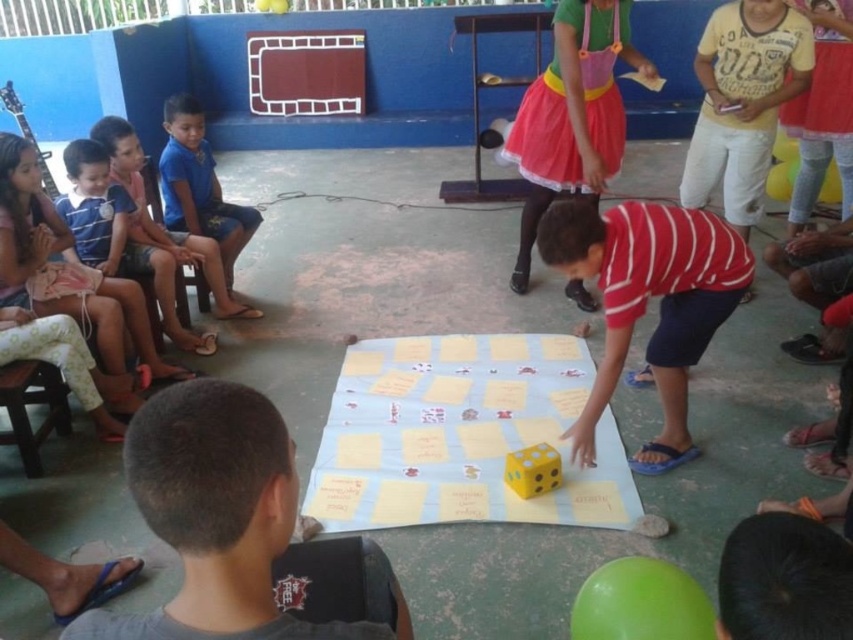
Who is more forward, (218, 628) or (668, 432)?

Positioned in front is point (218, 628).

Who is lower down, brown hair at center or yellow matte dice at center?

brown hair at center

I want to click on brown hair at center, so click(218, 518).

Where is `brown hair at center`? Image resolution: width=853 pixels, height=640 pixels. brown hair at center is located at coordinates (218, 518).

Between matte red skirt at center and striped cotton shirt at left, which one has less height?

striped cotton shirt at left is shorter.

Where is `matte red skirt at center`? matte red skirt at center is located at coordinates (572, 115).

Is matte red skirt at center below blue fabric shorts at left?

Incorrect, matte red skirt at center is not positioned below blue fabric shorts at left.

The image size is (853, 640). I want to click on matte red skirt at center, so click(572, 115).

Which is in front, point (590, 74) or point (212, 186)?

Point (590, 74) is in front.

Where is `matte red skirt at center`? matte red skirt at center is located at coordinates click(x=572, y=115).